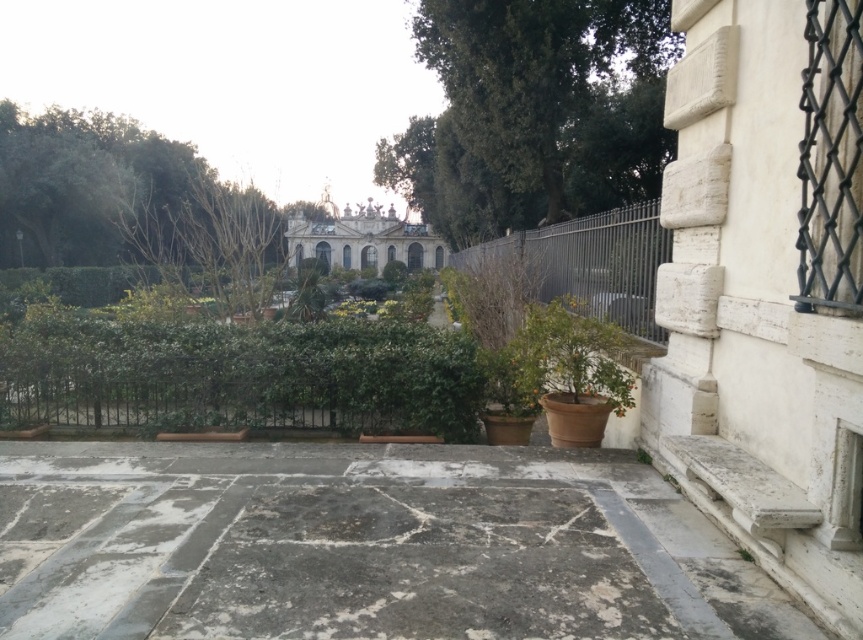
Question: Estimate the real-world distances between objects in this image. Which object is closer to the metallic wire fence at center?

Choices:
 (A) gray stone pavement at center
 (B) green matte plant at lower right
 (C) green leafy hedge at center

Answer: (C)

Question: Is gray stone pavement at center to the right of green matte plant at lower right from the viewer's perspective?

Choices:
 (A) yes
 (B) no

Answer: (B)

Question: Can you confirm if green leafy hedge at center is wider than green matte plant at lower right?

Choices:
 (A) yes
 (B) no

Answer: (A)

Question: Is the position of green leafy hedge at center more distant than that of metallic wire fence at center?

Choices:
 (A) yes
 (B) no

Answer: (B)

Question: Which object appears farthest from the camera in this image?

Choices:
 (A) green leafy hedge at center
 (B) gray stone pavement at center
 (C) green matte plant at lower right
 (D) metallic wire fence at center

Answer: (D)

Question: Which object appears closest to the camera in this image?

Choices:
 (A) green matte plant at lower right
 (B) gray stone pavement at center
 (C) green leafy hedge at center
 (D) metallic wire fence at center

Answer: (B)